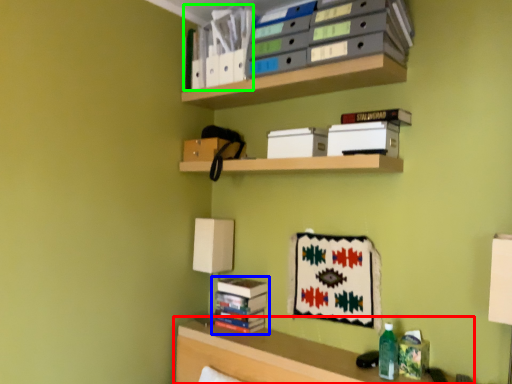
Question: Considering the real-world distances, which object is closest to shelf (highlighted by a red box)? book (highlighted by a blue box) or book (highlighted by a green box).

Choices:
 (A) book
 (B) book

Answer: (A)